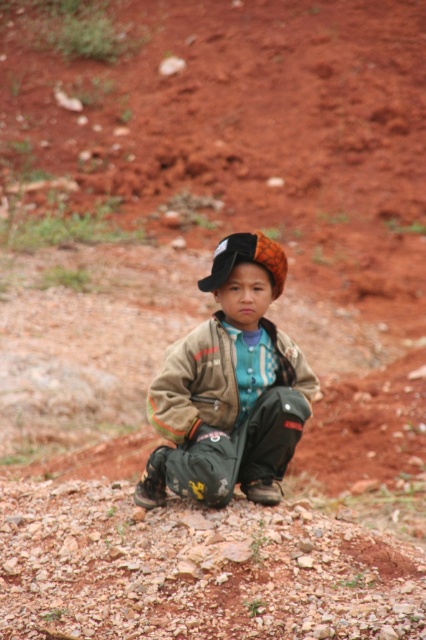
You are a fashion designer analyzing clothing sizes in the image. The child is wearing camouflage pants at center and brown textured jacket at center. Which clothing item has a larger size?

The camouflage pants at center is bigger than brown textured jacket at center.

You are a photographer trying to capture the child in the image. You want to focus on the brown textured jacket at center and the orange patterned hat at center. Which object should you adjust your camera focus on first if you want to ensure both are in focus?

The brown textured jacket at center is closer to the viewer than the orange patterned hat at center, so you should focus on the brown textured jacket at center first to ensure both are in focus.